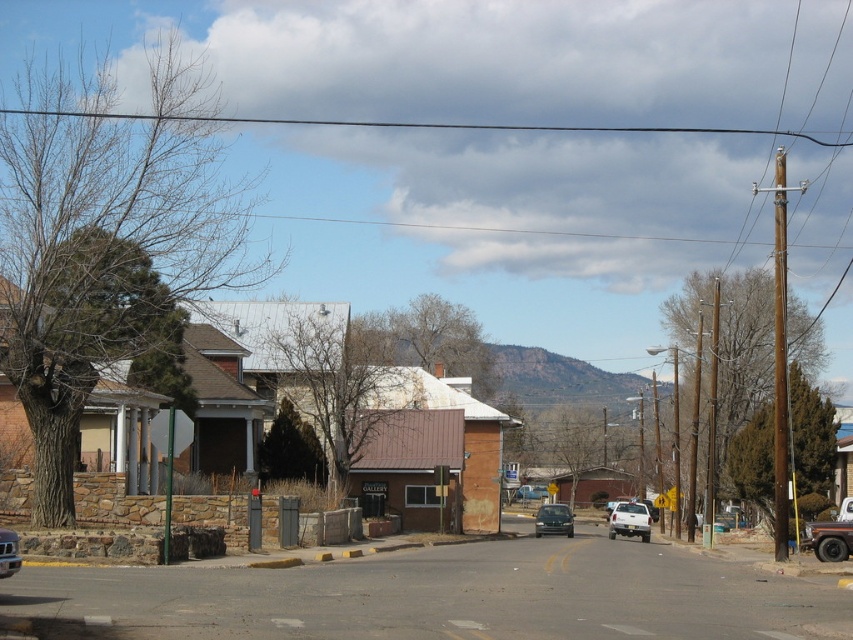
Is brushed metal truck at lower right to the right of metallic silver car at center from the viewer's perspective?

Correct, you'll find brushed metal truck at lower right to the right of metallic silver car at center.

Is brushed metal truck at lower right positioned at the back of metallic silver car at center?

That is True.

Does point (836, 544) come in front of point (3, 557)?

No, (836, 544) is further to viewer.

Locate an element on the screen. The width and height of the screenshot is (853, 640). brushed metal truck at lower right is located at coordinates 831,534.

Is brown stone building at center positioned behind metallic silver car at center?

Yes, brown stone building at center is further from the viewer.

Can you confirm if brown stone building at center is thinner than metallic silver car at center?

In fact, brown stone building at center might be wider than metallic silver car at center.

Is point (329, 352) positioned in front of point (7, 561)?

No, it is behind (7, 561).

Locate an element on the screen. Image resolution: width=853 pixels, height=640 pixels. brown stone building at center is located at coordinates (381, 417).

Is satin black sedan at center above metallic silver car at center?

No.

Locate an element on the screen. The width and height of the screenshot is (853, 640). satin black sedan at center is located at coordinates (553, 520).